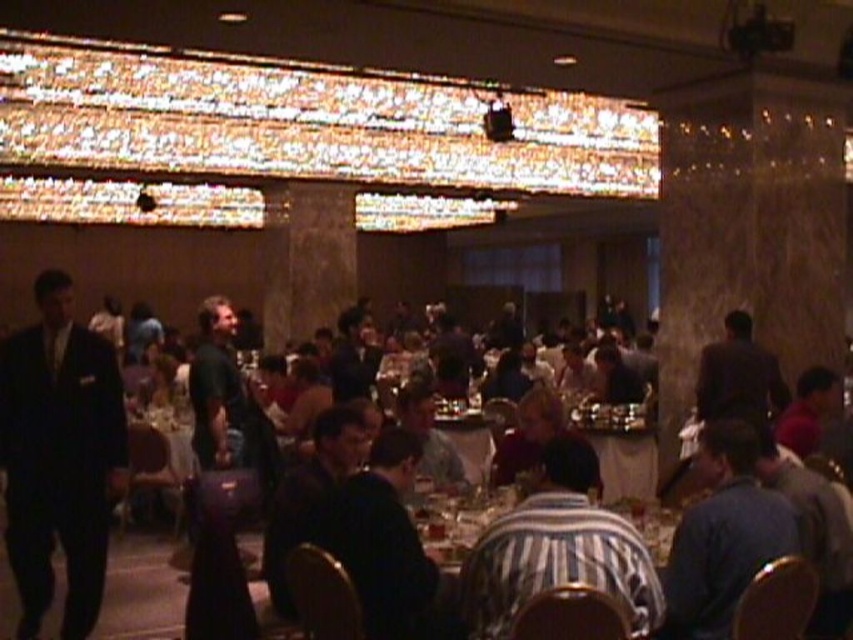
Is striped fabric shirt at center smaller than striped fabric table at center?

No.

Looking at this image, who is more forward, (x=514, y=557) or (x=509, y=493)?

Point (x=514, y=557) is more forward.

The width and height of the screenshot is (853, 640). In order to click on striped fabric shirt at center in this screenshot , I will do `click(556, 548)`.

Is striped fabric shirt at center shorter than blue fabric shirt at lower right?

Yes, striped fabric shirt at center is shorter than blue fabric shirt at lower right.

Which is above, striped fabric shirt at center or blue fabric shirt at lower right?

striped fabric shirt at center is above.

Who is more distant from viewer, (544, 576) or (695, 502)?

Point (695, 502)

Where is `striped fabric shirt at center`? The height and width of the screenshot is (640, 853). striped fabric shirt at center is located at coordinates (556, 548).

Who is positioned more to the left, black suit at left or blue fabric shirt at lower right?

Positioned to the left is black suit at left.

Can you confirm if black suit at left is bigger than blue fabric shirt at lower right?

Yes.

Which is in front, point (103, 561) or point (722, 580)?

Positioned in front is point (722, 580).

At what (x,y) coordinates should I click in order to perform the action: click on black suit at left. Please return your answer as a coordinate pair (x, y). The image size is (853, 640). Looking at the image, I should click on (59, 456).